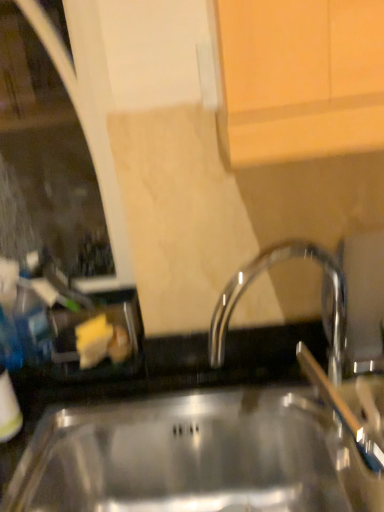
At what (x,y) coordinates should I click in order to perform the action: click on stainless steel sink at center. Please return your answer as a coordinate pair (x, y). This screenshot has width=384, height=512. Looking at the image, I should click on (195, 457).

What do you see at coordinates (195, 457) in the screenshot? I see `stainless steel sink at center` at bounding box center [195, 457].

Find the location of a particular element. The height and width of the screenshot is (512, 384). stainless steel sink at center is located at coordinates (195, 457).